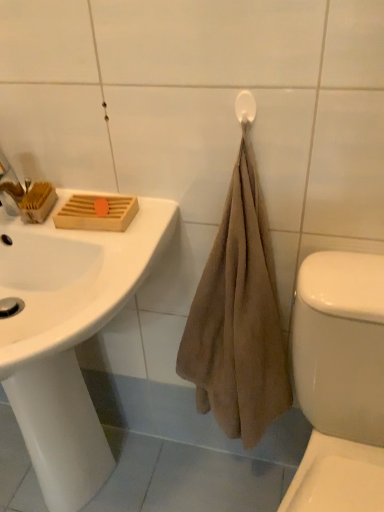
Question: Considering the positions of white glossy toilet at lower right and white plastic towel bar at upper right in the image, is white glossy toilet at lower right taller or shorter than white plastic towel bar at upper right?

Choices:
 (A) tall
 (B) short

Answer: (A)

Question: Is white glossy toilet at lower right in front of or behind white plastic towel bar at upper right in the image?

Choices:
 (A) behind
 (B) front

Answer: (B)

Question: Based on their relative distances, which object is nearer to the white glossy toilet at lower right?

Choices:
 (A) white plastic towel bar at upper right
 (B) white glossy sink at upper left

Answer: (B)

Question: Which object is the closest to the white plastic towel bar at upper right?

Choices:
 (A) white glossy sink at upper left
 (B) white glossy toilet at lower right

Answer: (B)